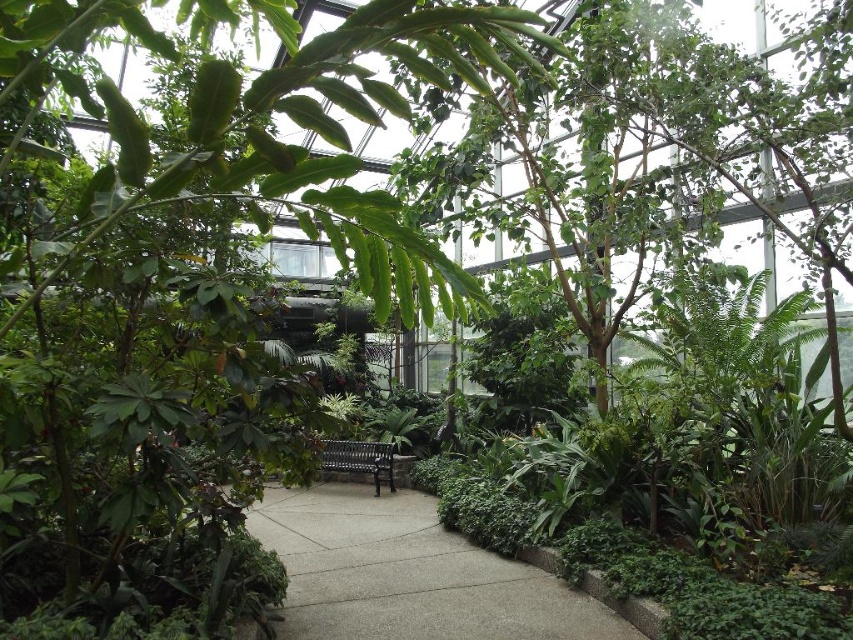
You are standing in the greenhouse and want to move from the point at coordinates point (180, 385) to the point at coordinates point (364, 541). Which direction should you move to reach your destination?

You should move backward to reach the point at coordinates point (364, 541) because point (180, 385) is in front of it.

You are a visitor in the greenhouse and want to sit down. You see the green leafy tree at center and the black metal bench at center. Which object is larger in size?

The green leafy tree at center is bigger than the black metal bench at center.

You are standing in the greenhouse and see a green leafy tree at center and concrete at center. Which one is higher up in the air?

The green leafy tree at center is located above the concrete at center, so it is higher up in the air.